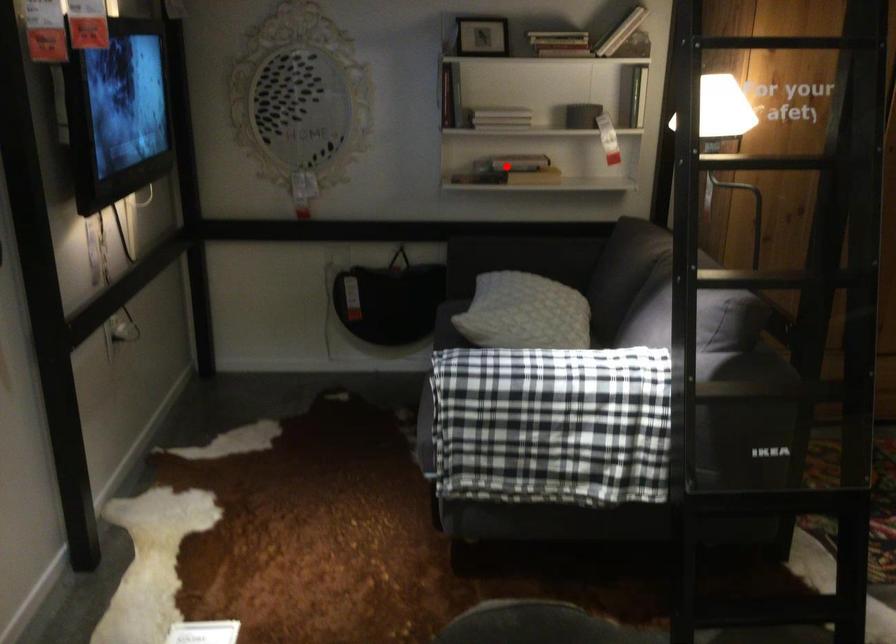
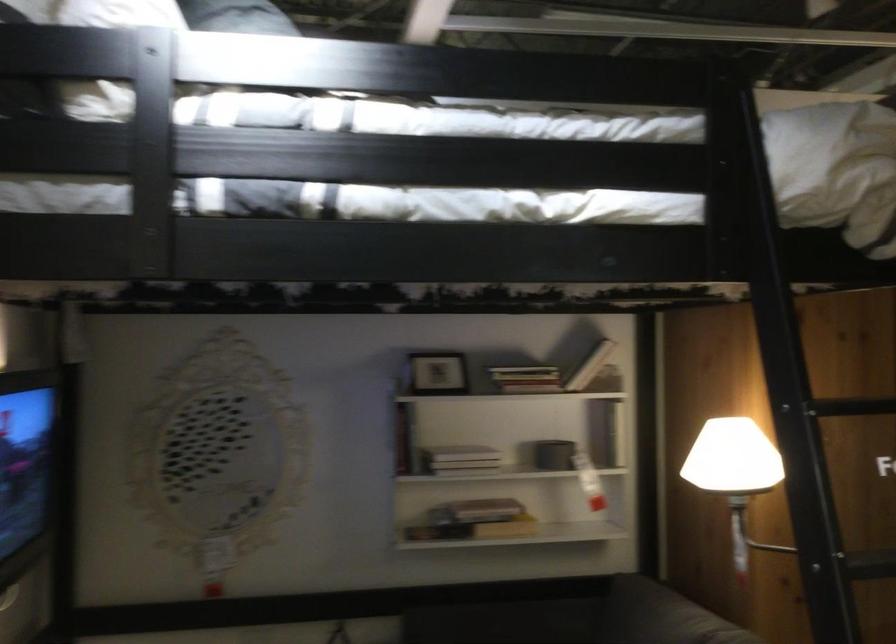
The point at the highlighted location is marked in the first image. Where is the corresponding point in the second image?

(474, 529)